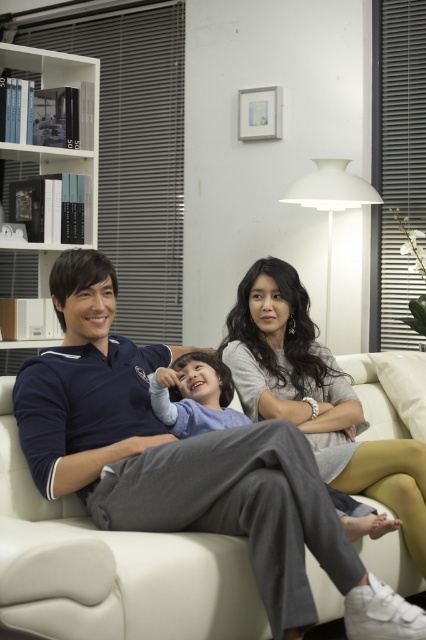
Question: Which object is closer to the camera taking this photo?

Choices:
 (A) gray knit sweater at center
 (B) white leather couch at center
 (C) white glossy bookshelf at left

Answer: (B)

Question: Can you confirm if white leather couch at center is smaller than light blue fabric shirt at center?

Choices:
 (A) no
 (B) yes

Answer: (A)

Question: Does white glossy bookshelf at left appear under light blue fabric shirt at center?

Choices:
 (A) no
 (B) yes

Answer: (A)

Question: Which point is closer to the camera?

Choices:
 (A) gray knit sweater at center
 (B) white glossy bookshelf at left
 (C) light blue fabric shirt at center
 (D) white leather couch at center

Answer: (D)

Question: Is white leather couch at center below light blue fabric shirt at center?

Choices:
 (A) no
 (B) yes

Answer: (B)

Question: Which object is the closest to the light blue fabric shirt at center?

Choices:
 (A) gray knit sweater at center
 (B) white glossy bookshelf at left
 (C) white leather couch at center

Answer: (A)